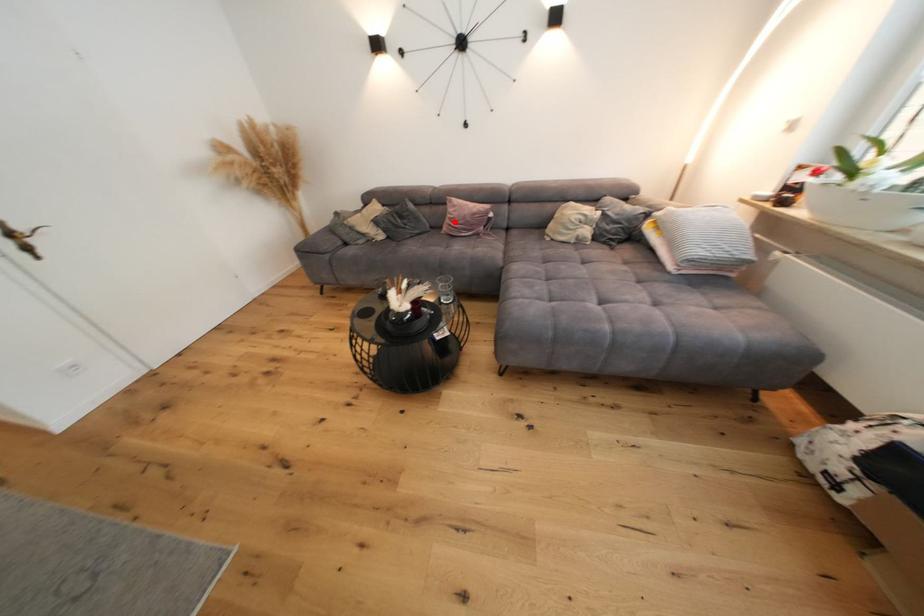
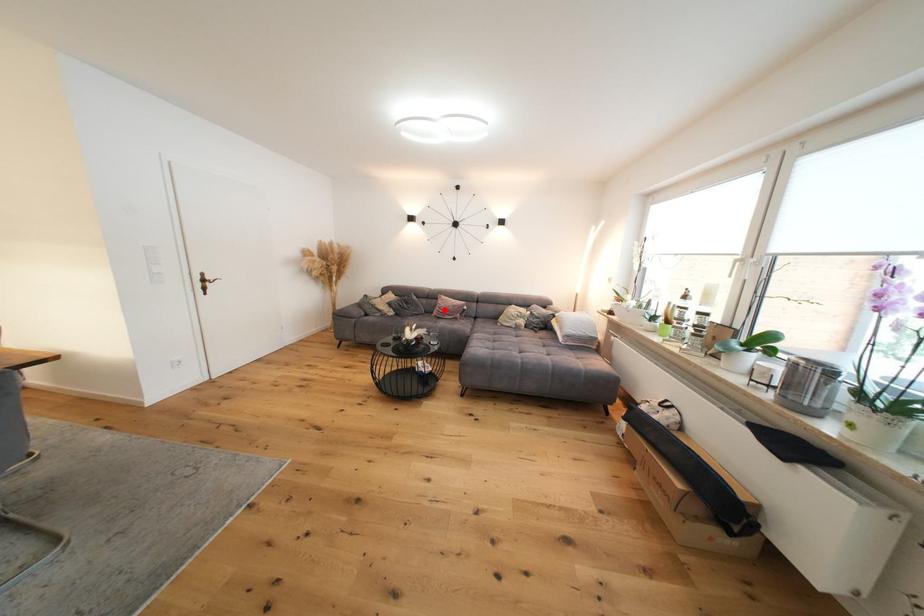
I am providing you with two images of the same scene from different viewpoints. A red point is marked on the first image and another point is marked on the second image. Do the highlighted points in image1 and image2 indicate the same real-world spot?

Yes